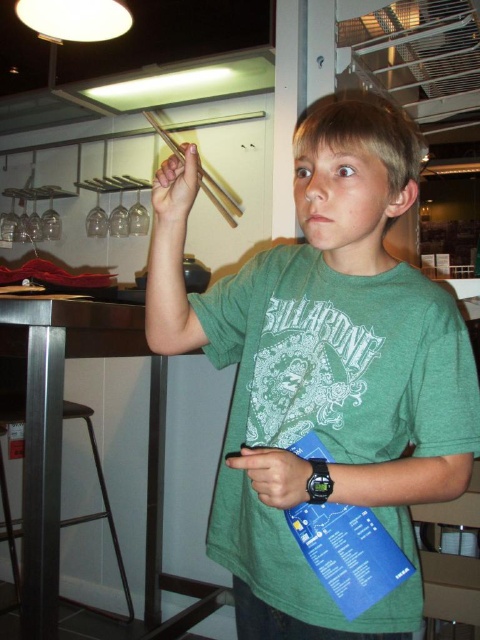
Consider the image. How distant is matte wood chopsticks at upper left from metallic silver stool at lower left?

matte wood chopsticks at upper left is 1.28 meters from metallic silver stool at lower left.

Is point (468, 362) behind point (95, 516)?

No, (468, 362) is in front of (95, 516).

In order to click on matte wood chopsticks at upper left in this screenshot , I will do click(328, 369).

Does metallic silver stool at lower left come behind matte wood chopsticks at upper center?

Yes, metallic silver stool at lower left is behind matte wood chopsticks at upper center.

Is metallic silver stool at lower left taller than matte wood chopsticks at upper center?

Yes.

Does point (7, 410) come closer to viewer compared to point (159, 170)?

No, it is not.

Locate an element on the screen. The width and height of the screenshot is (480, 640). metallic silver stool at lower left is located at coordinates (101, 497).

Consider the image. Is matte green t-shirt at center wider than matte wood chopsticks at upper center?

Correct, the width of matte green t-shirt at center exceeds that of matte wood chopsticks at upper center.

Which is above, matte green t-shirt at center or matte wood chopsticks at upper center?

matte wood chopsticks at upper center is above.

Is point (273, 467) behind point (172, 214)?

No, (273, 467) is in front of (172, 214).

Locate an element on the screen. Image resolution: width=480 pixels, height=640 pixels. matte green t-shirt at center is located at coordinates (274, 474).